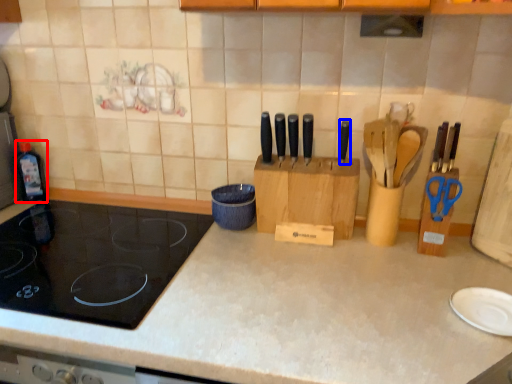
Question: Which point is further to the camera, bottle (highlighted by a red box) or knife (highlighted by a blue box)?

Choices:
 (A) bottle
 (B) knife

Answer: (A)